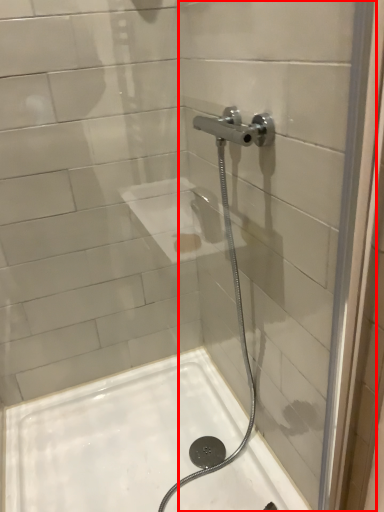
Question: From the image's perspective, what is the correct spatial positioning of glass door (annotated by the red box) in reference to bath?

Choices:
 (A) above
 (B) below

Answer: (A)